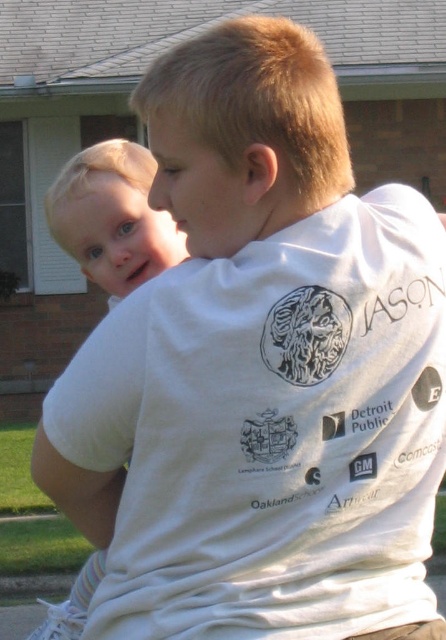
In the scene shown: Can you confirm if light blonde hair at left is smaller than blonde hair baby at upper left?

No, light blonde hair at left is not smaller than blonde hair baby at upper left.

Which of these two, light blonde hair at left or blonde hair baby at upper left, stands taller?

light blonde hair at left

Locate an element on the screen. The width and height of the screenshot is (446, 640). light blonde hair at left is located at coordinates (112, 218).